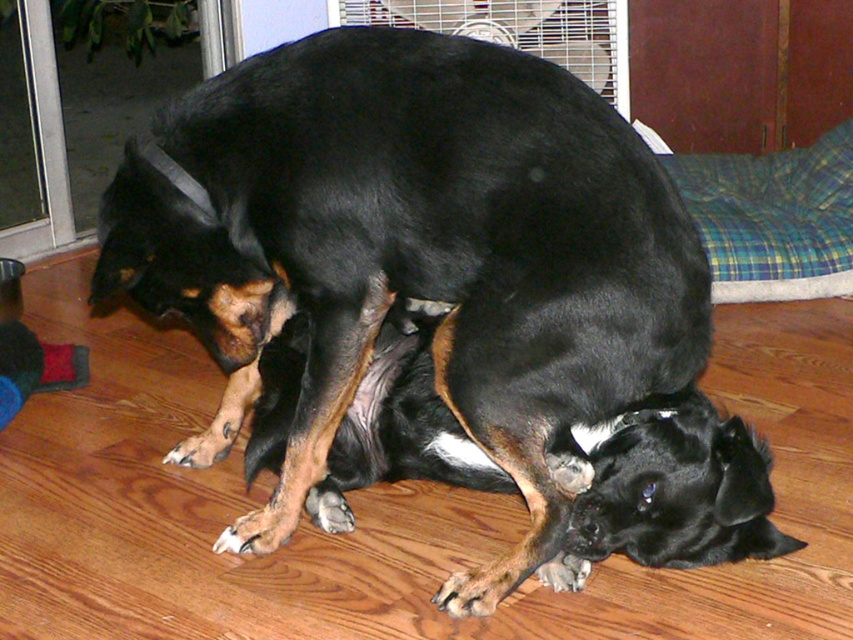
You are a dog owner trying to decide if your black smooth dog at center can fit on the plaid fabric dog bed at upper right. Based on their sizes, can it fit?

The black smooth dog at center is wider than the plaid fabric dog bed at upper right, so it may not fit comfortably on the bed.

You are a dog owner who wants to place a new dog bed in the room. The existing plaid fabric dog bed at upper right is already in the room. Where should you place the new dog bed so that the black smooth dog at center can easily reach both beds?

Place the new dog bed near the black smooth dog at center so it can reach both the new bed and the plaid fabric dog bed at upper right.